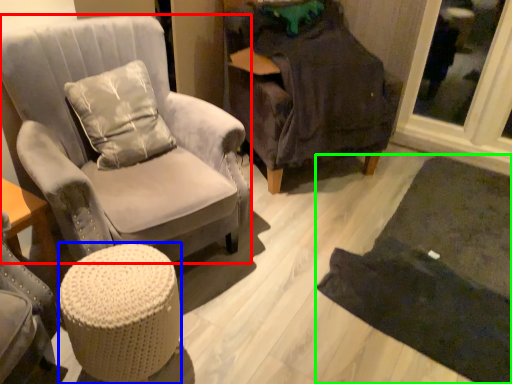
Question: Estimate the real-world distances between objects in this image. Which object is farther from chair (highlighted by a red box), stool (highlighted by a blue box) or mat (highlighted by a green box)?

Choices:
 (A) stool
 (B) mat

Answer: (B)